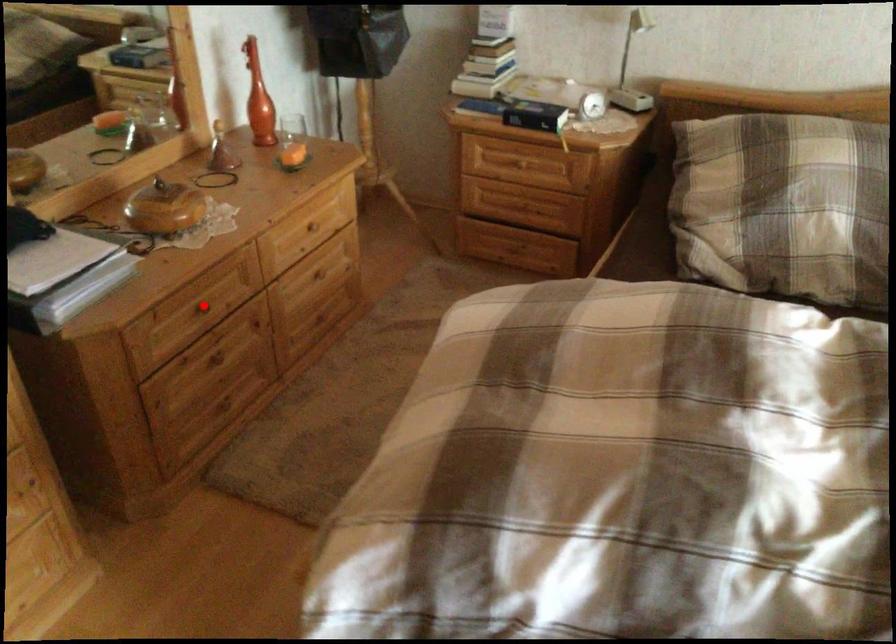
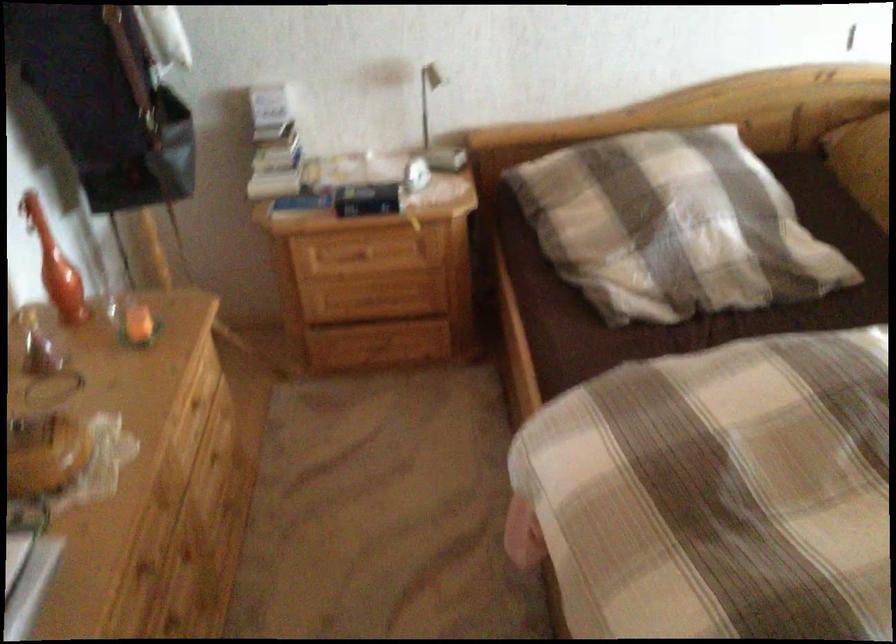
Question: I am providing you with two images of the same scene from different viewpoints. Image1 has a red point marked. In image2, the corresponding 3D location appears at what relative position? Reply with the corresponding letter.

Choices:
 (A) Closer
 (B) Farther

Answer: (A)